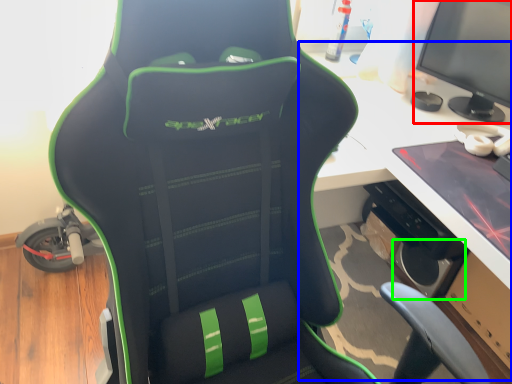
Question: Which object is positioned farthest from computer monitor (highlighted by a red box)? Select from computer desk (highlighted by a blue box) and speaker (highlighted by a green box).

Choices:
 (A) computer desk
 (B) speaker

Answer: (B)